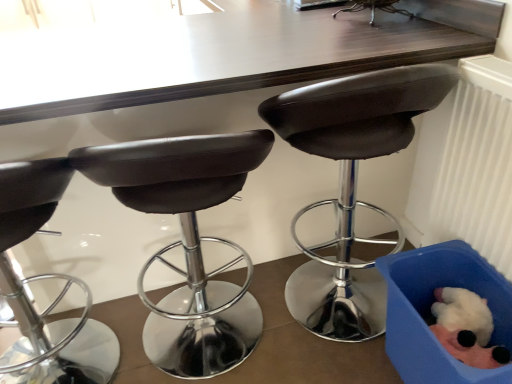
Question: Which direction should I rotate to look at metallic silver stool at center, positioned as the 1th chair in right-to-left order?

Choices:
 (A) right
 (B) left

Answer: (A)

Question: Is blue fabric box at lower right oriented towards matte black stool at center, the second chair from the right?

Choices:
 (A) no
 (B) yes

Answer: (A)

Question: From a real-world perspective, is blue fabric box at lower right on top of matte black stool at center, the third chair in the left-to-right sequence?

Choices:
 (A) yes
 (B) no

Answer: (B)

Question: From the image's perspective, is blue fabric box at lower right above matte black stool at center, the second chair from the right?

Choices:
 (A) no
 (B) yes

Answer: (A)

Question: Is blue fabric box at lower right to the left of matte black stool at center, the second chair from the right, from the viewer's perspective?

Choices:
 (A) yes
 (B) no

Answer: (B)

Question: Can you confirm if blue fabric box at lower right is bigger than matte black stool at center, the third chair in the left-to-right sequence?

Choices:
 (A) yes
 (B) no

Answer: (B)

Question: Is blue fabric box at lower right thinner than matte black stool at center, the second chair from the right?

Choices:
 (A) no
 (B) yes

Answer: (B)

Question: From a real-world perspective, is metallic silver stool at center, which is the fourth chair from left to right, beneath fluffy white plush toy at lower right?

Choices:
 (A) no
 (B) yes

Answer: (A)

Question: Considering the relative positions of metallic silver stool at center, positioned as the 1th chair in right-to-left order, and fluffy white plush toy at lower right in the image provided, is metallic silver stool at center, positioned as the 1th chair in right-to-left order, behind fluffy white plush toy at lower right?

Choices:
 (A) yes
 (B) no

Answer: (A)

Question: Could fluffy white plush toy at lower right be considered to be inside metallic silver stool at center, positioned as the 1th chair in right-to-left order?

Choices:
 (A) no
 (B) yes

Answer: (A)

Question: Can we say metallic silver stool at center, which is the fourth chair from left to right, lies outside fluffy white plush toy at lower right?

Choices:
 (A) yes
 (B) no

Answer: (A)

Question: Considering the relative positions of metallic silver stool at center, which is the fourth chair from left to right, and fluffy white plush toy at lower right in the image provided, is metallic silver stool at center, which is the fourth chair from left to right, to the left of fluffy white plush toy at lower right from the viewer's perspective?

Choices:
 (A) yes
 (B) no

Answer: (A)

Question: Is metallic silver stool at center, which is the fourth chair from left to right, at the right side of fluffy white plush toy at lower right?

Choices:
 (A) no
 (B) yes

Answer: (A)

Question: From a real-world perspective, is matte black stool at center, the second chair from the left, over white plastic radiator at right?

Choices:
 (A) yes
 (B) no

Answer: (B)